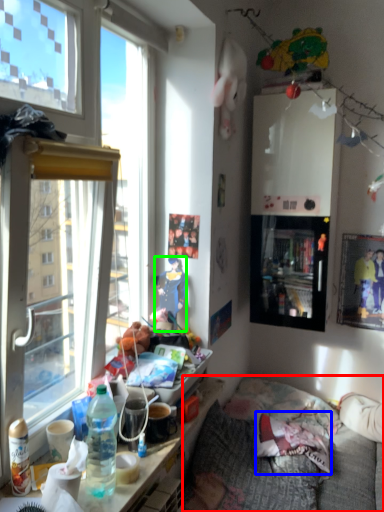
Question: Based on their relative distances, which object is farther from studio couch (highlighted by a red box)? Choose from pillow (highlighted by a blue box) and person (highlighted by a green box).

Choices:
 (A) pillow
 (B) person

Answer: (B)